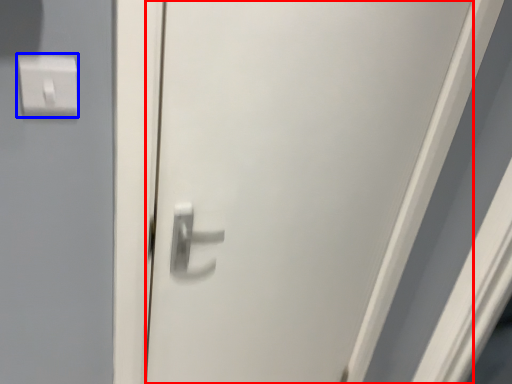
Question: Which object is further to the camera taking this photo, door (highlighted by a red box) or light switch (highlighted by a blue box)?

Choices:
 (A) door
 (B) light switch

Answer: (B)